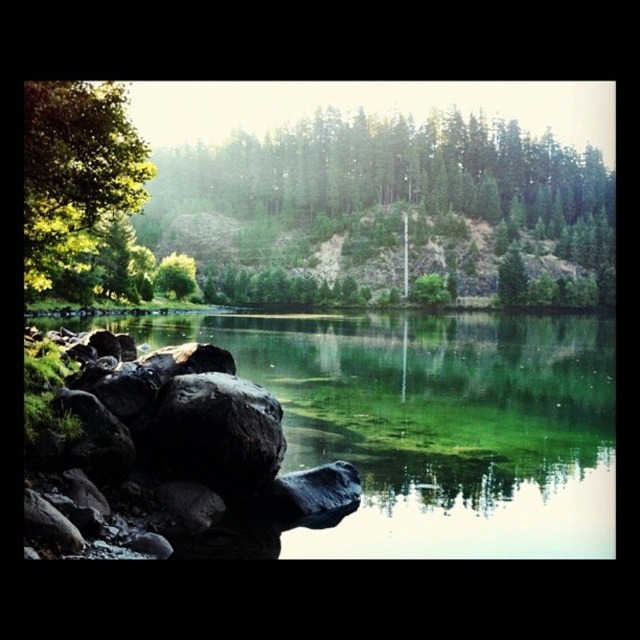
Question: Is green leafy tree at left thinner than black matte rock at lower left?

Choices:
 (A) no
 (B) yes

Answer: (A)

Question: Which object appears closest to the camera in this image?

Choices:
 (A) green smooth water at center
 (B) black matte rock at lower left

Answer: (A)

Question: Which is nearer to the green leafy tree at left?

Choices:
 (A) green smooth water at center
 (B) black matte rock at lower left

Answer: (B)

Question: Is green smooth water at center thinner than black matte rock at lower left?

Choices:
 (A) yes
 (B) no

Answer: (B)

Question: Which object is the farthest from the black matte rock at lower left?

Choices:
 (A) green leafy tree at left
 (B) green smooth water at center

Answer: (B)

Question: Can you confirm if green leafy tree at left is smaller than black matte rock at lower left?

Choices:
 (A) yes
 (B) no

Answer: (B)